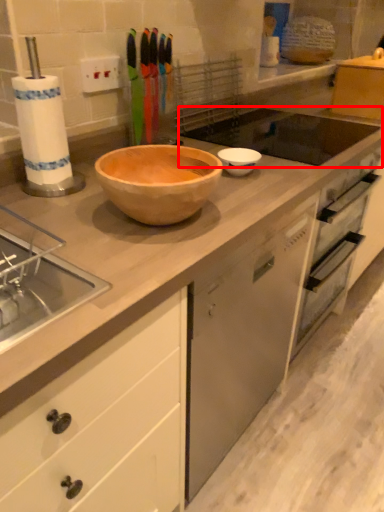
Question: From the image's perspective, where is sink (annotated by the red box) located relative to basin?

Choices:
 (A) above
 (B) below

Answer: (A)